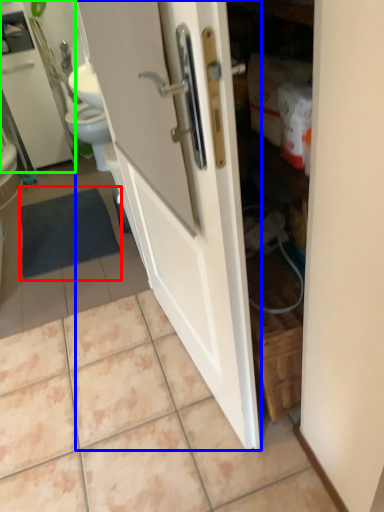
Question: Which is farther away from bath mat (highlighted by a red box)? door (highlighted by a blue box) or medicine cabinet (highlighted by a green box)?

Choices:
 (A) door
 (B) medicine cabinet

Answer: (A)